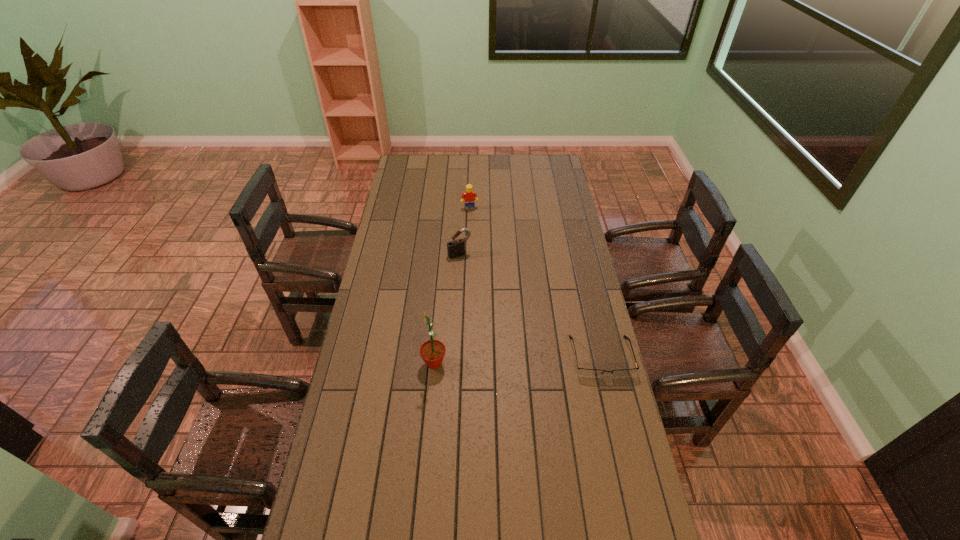
Locate an element on the screen. free space on the desktop that is between the sunflower and the spectacles and is positioned with the keyhole on the front of the padlock is located at coordinates (520, 360).

I want to click on vacant spot on the desktop that is between the sunflower and the shortest object and is positioned on the front-facing side of the Lego, so point(512,360).